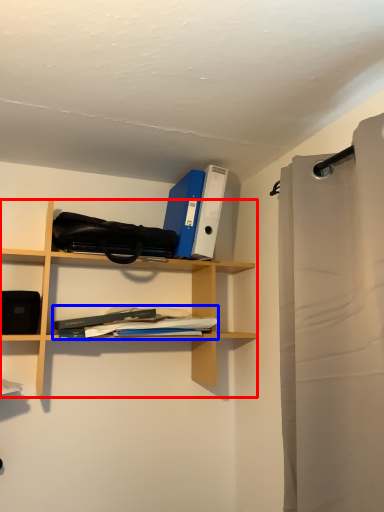
Question: Which of the following is the closest to the observer, shelf (highlighted by a red box) or book (highlighted by a blue box)?

Choices:
 (A) shelf
 (B) book

Answer: (A)